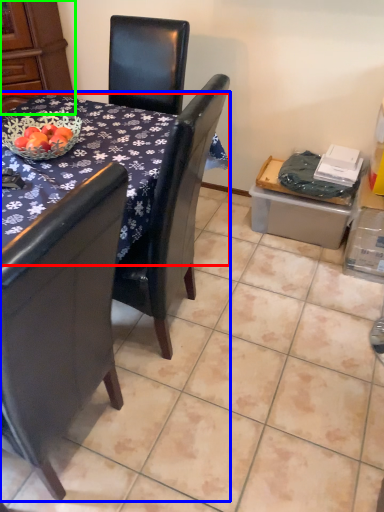
Question: Estimate the real-world distances between objects in this image. Which object is farther from desk (highlighted by a red box), table (highlighted by a blue box) or armoire (highlighted by a green box)?

Choices:
 (A) table
 (B) armoire

Answer: (B)